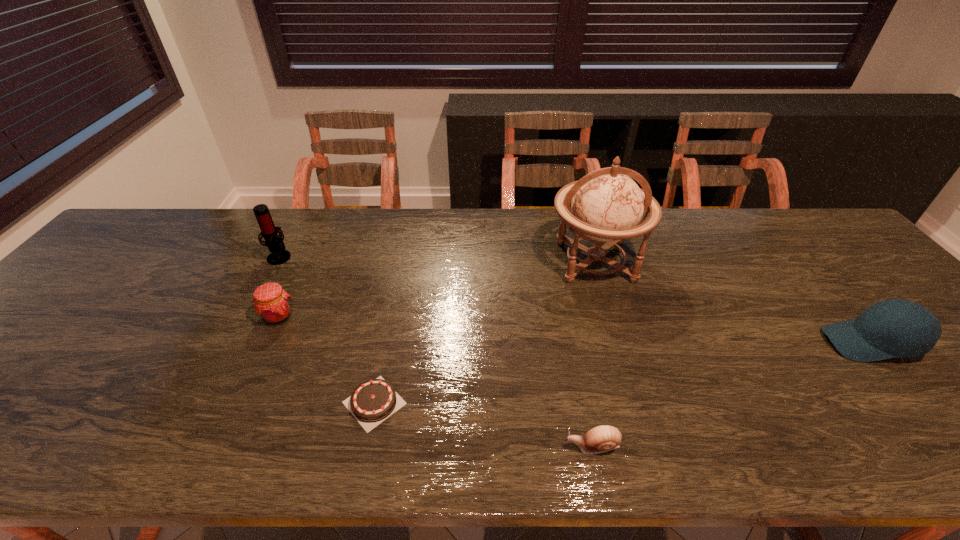
This screenshot has height=540, width=960. Find the location of `chocolate cake`. chocolate cake is located at coordinates (373, 401).

You are a GUI agent. You are given a task and a screenshot of the screen. Output one action in this format:
    pyautogui.click(x=<x>, y=<y>)
    Task: Click on the vacant space situated at the front of the globe showing Africa
    The width and height of the screenshot is (960, 540).
    Given the screenshot: What is the action you would take?
    pyautogui.click(x=647, y=433)

The image size is (960, 540). Find the location of `vacant point located 0.100m on the right of the microphone`. vacant point located 0.100m on the right of the microphone is located at coordinates (325, 256).

The width and height of the screenshot is (960, 540). In order to click on vacant space located on the front-facing side of the rightmost object in this screenshot , I will do `click(795, 342)`.

This screenshot has height=540, width=960. Find the location of `vacant area located on the front-facing side of the rightmost object`. vacant area located on the front-facing side of the rightmost object is located at coordinates (x=708, y=342).

You are a GUI agent. You are given a task and a screenshot of the screen. Output one action in this format:
    pyautogui.click(x=<x>, y=<y>)
    Task: Click on the free location located 0.300m on the front-facing side of the rightmost object
    The image size is (960, 540).
    Given the screenshot: What is the action you would take?
    699,342

You are a GUI agent. You are given a task and a screenshot of the screen. Output one action in this format:
    pyautogui.click(x=<x>, y=<y>)
    Task: Click on the vacant position located 0.340m on the left of the fourth tallest object
    The image size is (960, 540).
    Given the screenshot: What is the action you would take?
    pyautogui.click(x=128, y=316)

You are a GUI agent. You are given a task and a screenshot of the screen. Output one action in this format:
    pyautogui.click(x=<x>, y=<y>)
    Task: Click on the vacant space located on the front-facing side of the escargot
    The image size is (960, 540).
    Given the screenshot: What is the action you would take?
    pyautogui.click(x=515, y=447)

Identify the location of vacant space located on the front-facing side of the escargot. The image size is (960, 540). (468, 447).

Where is `vacant space positioned on the front-facing side of the escargot`? Image resolution: width=960 pixels, height=540 pixels. vacant space positioned on the front-facing side of the escargot is located at coordinates (509, 447).